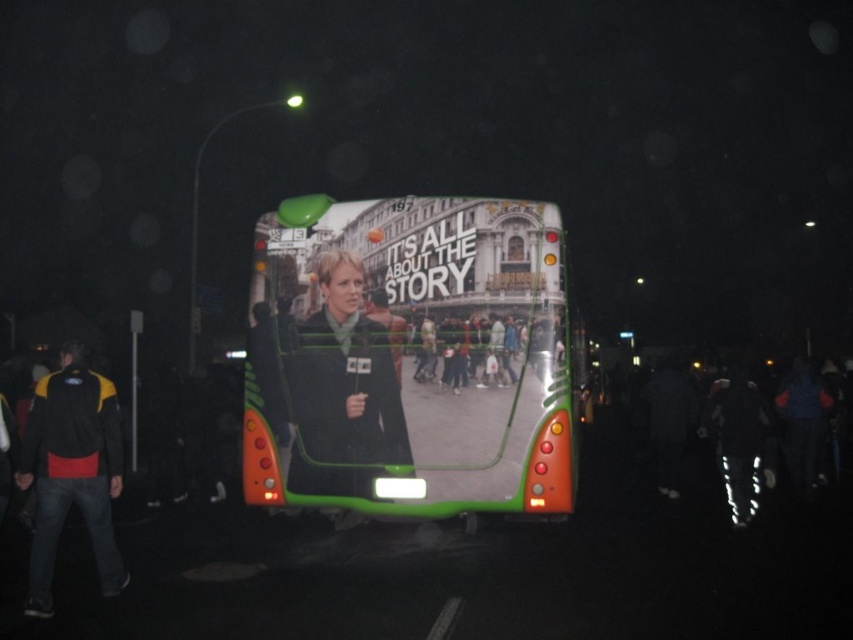
Between matte black jacket at center and black/yellow jacket at left, which one has less height?

black/yellow jacket at left is shorter.

Does matte black jacket at center have a greater height compared to black/yellow jacket at left?

Indeed, matte black jacket at center has a greater height compared to black/yellow jacket at left.

Between point (288, 364) and point (57, 513), which one is positioned behind?

Positioned behind is point (288, 364).

Locate an element on the screen. This screenshot has width=853, height=640. matte black jacket at center is located at coordinates (341, 388).

Identify the location of green matte bus at center. The image size is (853, 640). (410, 358).

Is point (265, 449) behind point (366, 451)?

Yes, point (265, 449) is farther from viewer.

Locate an element on the screen. This screenshot has width=853, height=640. green matte bus at center is located at coordinates (410, 358).

Does green matte bus at center appear on the right side of black/yellow jacket at left?

Yes, green matte bus at center is to the right of black/yellow jacket at left.

Between point (273, 218) and point (83, 417), which one is positioned in front?

Point (83, 417)

Identify the location of green matte bus at center. Image resolution: width=853 pixels, height=640 pixels. (410, 358).